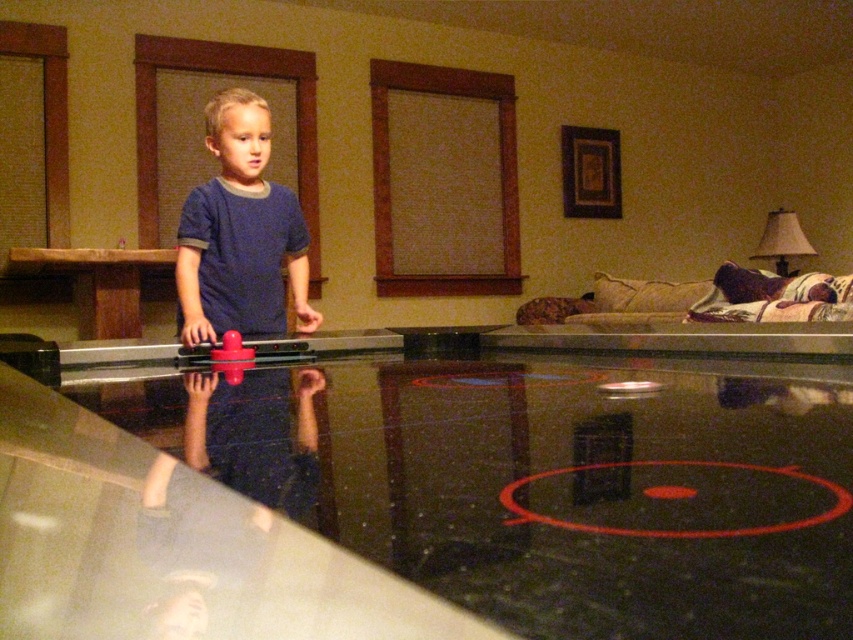
You are a parent trying to ensure your child is safe while playing. The child is wearing a blue matte shirt at center and standing near a transparent glass table at center. Which object is positioned lower in the scene?

The transparent glass table at center is located below the blue matte shirt at center, meaning the table is lower than the shirt in the scene.

You are a parent trying to ensure your child stays safe while playing. The transparent glass table at center has sharp edges, and the rubberized plastic toy at center is a small choking hazard. Which object should you move to prevent the child from reaching both at the same time?

You should move the transparent glass table at center because it is 35.38 inches away from the rubberized plastic toy at center, so moving the table would create more distance between the two hazards, making it harder for the child to reach both simultaneously.

You are standing in the living room and want to place a decorative vase on the transparent glass table at center. To ensure it stays balanced, you need to know the exact center point of the table. According to the coordinates provided, where should you place the vase?

The exact center point of the transparent glass table at center is at coordinates 0.786 on the x axis and 0.498 on the y axis, so you should place the vase at point (424, 502) to ensure it stays balanced.